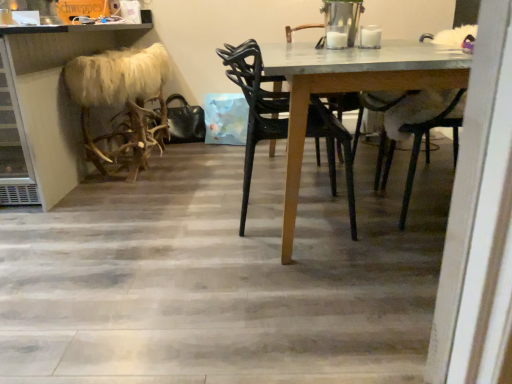
Question: Can you see black plastic chair at center touching white fur at upper right?

Choices:
 (A) no
 (B) yes

Answer: (A)

Question: Is black plastic chair at center outside of white fur at upper right?

Choices:
 (A) yes
 (B) no

Answer: (A)

Question: Can you confirm if black plastic chair at center is taller than white fur at upper right?

Choices:
 (A) yes
 (B) no

Answer: (B)

Question: Would you say black plastic chair at center is a long distance from white fur at upper right?

Choices:
 (A) no
 (B) yes

Answer: (B)

Question: Can you confirm if black plastic chair at center is shorter than white fur at upper right?

Choices:
 (A) yes
 (B) no

Answer: (A)

Question: In the image, is faux fur stool at left positioned in front of or behind furry white antlers at left?

Choices:
 (A) behind
 (B) front

Answer: (B)

Question: Is faux fur stool at left situated inside furry white antlers at left or outside?

Choices:
 (A) inside
 (B) outside

Answer: (B)

Question: Is faux fur stool at left taller or shorter than furry white antlers at left?

Choices:
 (A) short
 (B) tall

Answer: (B)

Question: Considering the positions of faux fur stool at left and furry white antlers at left in the image, is faux fur stool at left bigger or smaller than furry white antlers at left?

Choices:
 (A) small
 (B) big

Answer: (B)

Question: From a real-world perspective, is furry white antlers at left above or below faux fur stool at left?

Choices:
 (A) above
 (B) below

Answer: (B)

Question: Do you think furry white antlers at left is within faux fur stool at left, or outside of it?

Choices:
 (A) inside
 (B) outside

Answer: (A)

Question: Considering the positions of furry white antlers at left and faux fur stool at left in the image, is furry white antlers at left bigger or smaller than faux fur stool at left?

Choices:
 (A) big
 (B) small

Answer: (B)

Question: Is furry white antlers at left in front of or behind faux fur stool at left in the image?

Choices:
 (A) front
 (B) behind

Answer: (B)

Question: Considering their positions, is faux fur stool at left located in front of or behind black plastic chair at center?

Choices:
 (A) front
 (B) behind

Answer: (B)

Question: In terms of height, does faux fur stool at left look taller or shorter compared to black plastic chair at center?

Choices:
 (A) short
 (B) tall

Answer: (B)